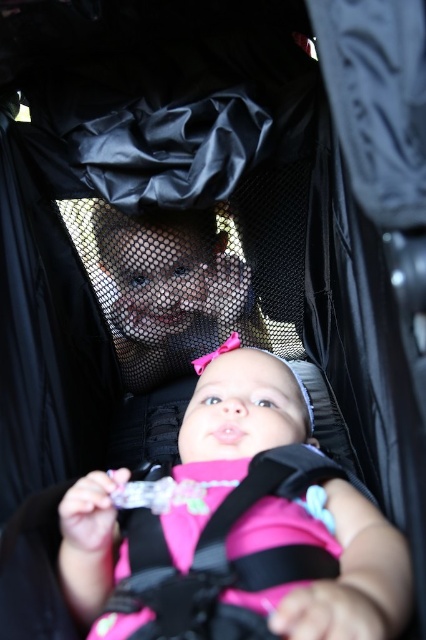
Can you confirm if pink fabric baby at center is positioned above pink fabric strap at center?

Yes.

Who is more distant from viewer, (126, 547) or (275, 461)?

Point (275, 461)

Identify the location of pink fabric baby at center. Image resolution: width=426 pixels, height=640 pixels. (339, 570).